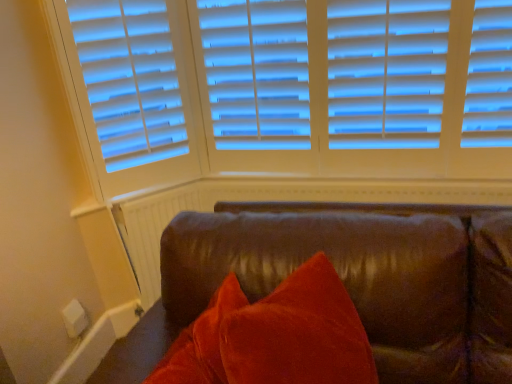
Question: Should I look upward or downward to see white textured radiator at lower left?

Choices:
 (A) down
 (B) up

Answer: (A)

Question: Can you confirm if white textured radiator at lower left is thinner than brown leather couch at lower right?

Choices:
 (A) yes
 (B) no

Answer: (A)

Question: From a real-world perspective, is white textured radiator at lower left physically above brown leather couch at lower right?

Choices:
 (A) no
 (B) yes

Answer: (B)

Question: From a real-world perspective, does white textured radiator at lower left sit lower than brown leather couch at lower right?

Choices:
 (A) yes
 (B) no

Answer: (B)

Question: Considering the relative positions of white textured radiator at lower left and brown leather couch at lower right in the image provided, is white textured radiator at lower left to the right of brown leather couch at lower right from the viewer's perspective?

Choices:
 (A) no
 (B) yes

Answer: (A)

Question: From the image's perspective, is white textured radiator at lower left located above brown leather couch at lower right?

Choices:
 (A) yes
 (B) no

Answer: (A)

Question: Can you confirm if white textured radiator at lower left is taller than brown leather couch at lower right?

Choices:
 (A) no
 (B) yes

Answer: (A)

Question: Is brown leather couch at lower right touching white textured radiator at lower left?

Choices:
 (A) no
 (B) yes

Answer: (A)

Question: From the image's perspective, is brown leather couch at lower right on top of white textured radiator at lower left?

Choices:
 (A) yes
 (B) no

Answer: (B)

Question: From a real-world perspective, is brown leather couch at lower right beneath white textured radiator at lower left?

Choices:
 (A) yes
 (B) no

Answer: (A)

Question: Does brown leather couch at lower right appear on the left side of white textured radiator at lower left?

Choices:
 (A) yes
 (B) no

Answer: (B)

Question: Does brown leather couch at lower right have a greater width compared to white textured radiator at lower left?

Choices:
 (A) no
 (B) yes

Answer: (B)

Question: Does brown leather couch at lower right appear on the right side of white textured radiator at lower left?

Choices:
 (A) yes
 (B) no

Answer: (A)

Question: Is white textured radiator at lower left bigger or smaller than brown leather couch at lower right?

Choices:
 (A) big
 (B) small

Answer: (B)